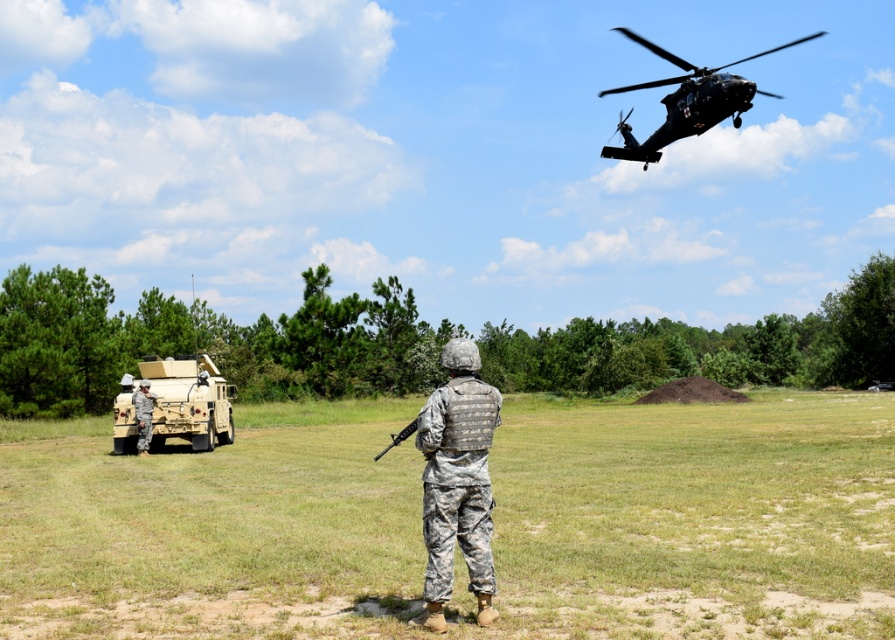
Question: Estimate the real-world distances between objects in this image. Which object is closer to the black matte helicopter at upper right?

Choices:
 (A) camouflage uniform at left
 (B) camouflage fabric armored vehicle at lower left
 (C) camouflage fabric field at center
 (D) camouflage fabric vest at center

Answer: (C)

Question: Can you confirm if camouflage fabric armored vehicle at lower left is thinner than camouflage fabric rifle at center?

Choices:
 (A) no
 (B) yes

Answer: (A)

Question: Does camouflage fabric armored vehicle at lower left appear on the left side of black matte helicopter at upper right?

Choices:
 (A) yes
 (B) no

Answer: (A)

Question: Can you confirm if camouflage fabric vest at center is positioned to the right of black matte helicopter at upper right?

Choices:
 (A) yes
 (B) no

Answer: (B)

Question: Which point is closer to the camera taking this photo?

Choices:
 (A) (155, 410)
 (B) (674, 128)

Answer: (B)

Question: Estimate the real-world distances between objects in this image. Which object is closer to the camouflage fabric rifle at center?

Choices:
 (A) camouflage fabric field at center
 (B) black matte helicopter at upper right

Answer: (A)